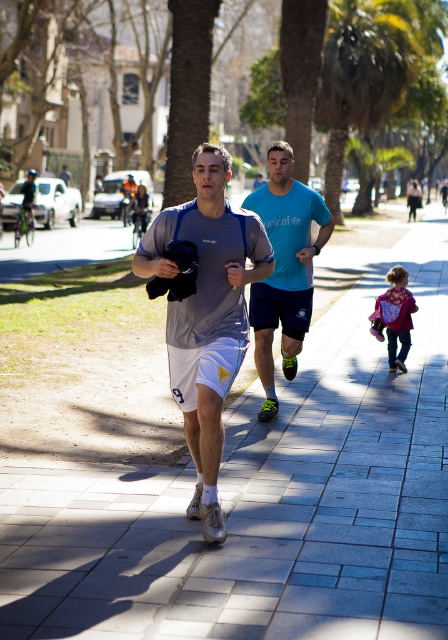
Question: Which point is farther from the camera taking this photo?

Choices:
 (A) (397, 316)
 (B) (417, 616)
 (C) (379, 74)

Answer: (C)

Question: Which is nearer to the gray concrete pavement at center?

Choices:
 (A) green leafy palm tree at center
 (B) velvet purple coat at center

Answer: (B)

Question: Can you confirm if gray concrete pavement at center is positioned above green leafy palm tree at center?

Choices:
 (A) no
 (B) yes

Answer: (A)

Question: Does gray fabric shirt at center appear on the left side of velvet purple coat at center?

Choices:
 (A) no
 (B) yes

Answer: (B)

Question: Among these objects, which one is farthest from the camera?

Choices:
 (A) blue t-shirt at center
 (B) gray fabric shirt at center
 (C) green leafy palm tree at center

Answer: (C)

Question: From the image, what is the correct spatial relationship of gray concrete pavement at center in relation to blue t-shirt at center?

Choices:
 (A) right
 (B) left

Answer: (A)